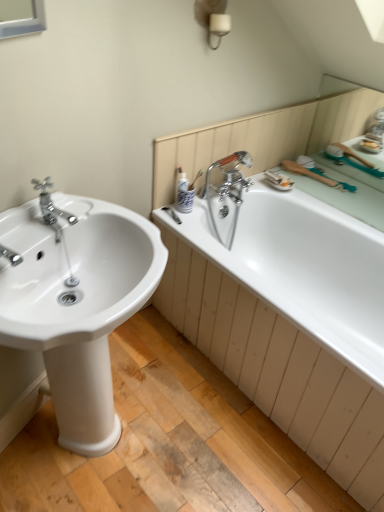
Describe the element at coordinates (51, 207) in the screenshot. I see `polished chrome faucet at left` at that location.

The width and height of the screenshot is (384, 512). Describe the element at coordinates (77, 303) in the screenshot. I see `white glossy sink at left` at that location.

You are a GUI agent. You are given a task and a screenshot of the screen. Output one action in this format:
    pyautogui.click(x=<x>, y=<y>)
    Task: Click on the polished chrome faucet at left
    This screenshot has width=384, height=512.
    Given the screenshot: What is the action you would take?
    pyautogui.click(x=51, y=207)

Is white glossy sink at left facing away from polished chrome faucet at left?

No, polished chrome faucet at left is not at the back of white glossy sink at left.

Between white glossy sink at left and polished chrome faucet at left, which one is positioned in front?

white glossy sink at left.

Consider the image. From the image's perspective, is white glossy sink at left above polished chrome faucet at left?

Actually, white glossy sink at left appears below polished chrome faucet at left in the image.

Which object is further away from the camera, white glossy sink at left or white glossy bathtub at right?

Positioned behind is white glossy bathtub at right.

Image resolution: width=384 pixels, height=512 pixels. In order to click on sink above the white glossy bathtub at right (from a real-world perspective) in this screenshot , I will do 77,303.

From the image's perspective, which object appears higher, white glossy sink at left or white glossy bathtub at right?

white glossy bathtub at right appears higher in the image.

From a real-world perspective, relative to white glossy sink at left, is white glossy bathtub at right vertically above or below?

Clearly, from a real-world perspective, white glossy bathtub at right is below white glossy sink at left.

Is white glossy bathtub at right inside or outside of white glossy sink at left?

white glossy bathtub at right is located beyond the bounds of white glossy sink at left.

Does point (355, 238) come behind point (58, 426)?

Yes, it is behind point (58, 426).

Are white glossy bathtub at right and white glossy sink at left far apart?

They are positioned close to each other.

From a real-world perspective, which object rests below the other?

white glossy sink at left, from a real-world perspective.

Which of these two, polished chrome faucet at left or white glossy sink at left, stands shorter?

With less height is polished chrome faucet at left.

Can you confirm if polished chrome faucet at left is smaller than white glossy sink at left?

Yes.

How different are the orientations of white glossy bathtub at right and polished chrome faucet at left in degrees?

The angle between the facing direction of white glossy bathtub at right and the facing direction of polished chrome faucet at left is 112 degrees.

The width and height of the screenshot is (384, 512). In the image, there is a polished chrome faucet at left. Find the location of `bathtub below it (from the image's perspective)`. bathtub below it (from the image's perspective) is located at coordinates (304, 269).

From a real-world perspective, is white glossy bathtub at right physically below polished chrome faucet at left?

Yes, from a real-world perspective, white glossy bathtub at right is beneath polished chrome faucet at left.

From a real-world perspective, is polished chrome faucet at left on white glossy bathtub at right?

Yes.

In the scene shown: Considering the sizes of objects polished chrome faucet at left and white glossy bathtub at right in the image provided, who is taller, polished chrome faucet at left or white glossy bathtub at right?

white glossy bathtub at right is taller.

At what (x,y) coordinates should I click in order to perform the action: click on tap on the left of the white glossy bathtub at right. Please return your answer as a coordinate pair (x, y). Image resolution: width=384 pixels, height=512 pixels. Looking at the image, I should click on pyautogui.click(x=51, y=207).

Between polished chrome faucet at left and white glossy bathtub at right, which one is positioned behind?

Positioned behind is polished chrome faucet at left.

Where is `sink below the polished chrome faucet at left (from the image's perspective)`? The width and height of the screenshot is (384, 512). sink below the polished chrome faucet at left (from the image's perspective) is located at coordinates (77, 303).

I want to click on sink on the left of the white glossy bathtub at right, so click(77, 303).

Consider the image. Based on their spatial positions, is polished chrome faucet at left or white glossy sink at left closer to white glossy bathtub at right?

The object closer to white glossy bathtub at right is white glossy sink at left.

Estimate the real-world distances between objects in this image. Which object is closer to polished chrome faucet at left, white glossy sink at left or white glossy bathtub at right?

white glossy sink at left lies closer to polished chrome faucet at left than the other object.

Looking at the image, which one is located further to polished chrome faucet at left, white glossy bathtub at right or white glossy sink at left?

Among the two, white glossy bathtub at right is located further to polished chrome faucet at left.

From the image, which object appears to be farther from white glossy bathtub at right, white glossy sink at left or polished chrome faucet at left?

polished chrome faucet at left is further to white glossy bathtub at right.

Based on their spatial positions, is white glossy bathtub at right or polished chrome faucet at left further from white glossy sink at left?

The object further to white glossy sink at left is white glossy bathtub at right.

Looking at the image, which one is located closer to white glossy sink at left, polished chrome faucet at left or white glossy bathtub at right?

The object closer to white glossy sink at left is polished chrome faucet at left.

The width and height of the screenshot is (384, 512). I want to click on sink situated between polished chrome faucet at left and white glossy bathtub at right from left to right, so click(77, 303).